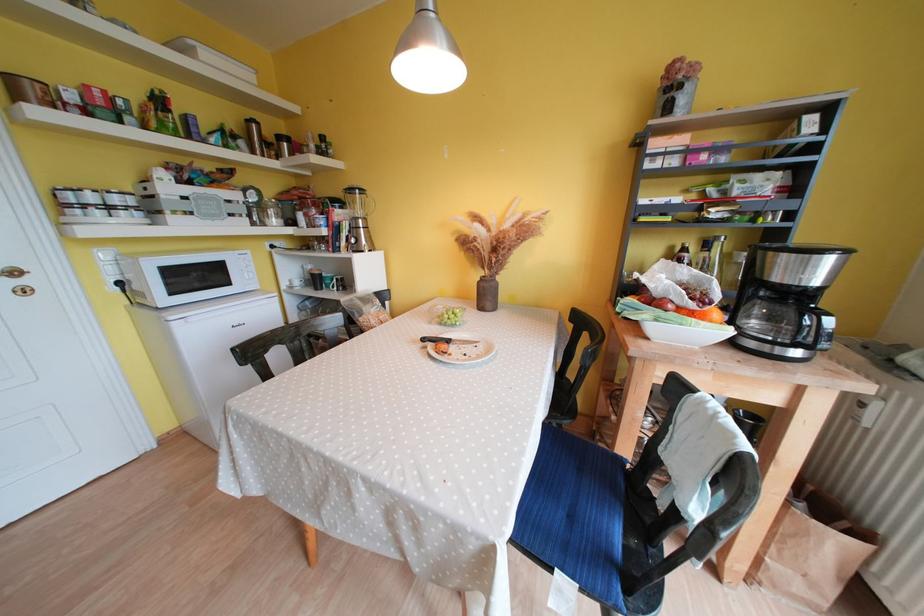
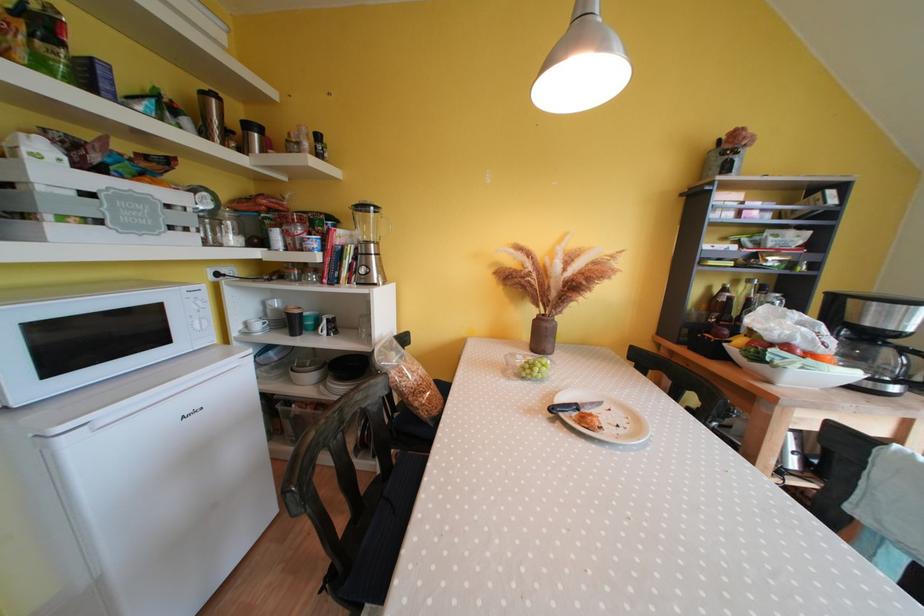
Locate, in the second image, the point that corresponds to (454,344) in the first image.

(582, 410)